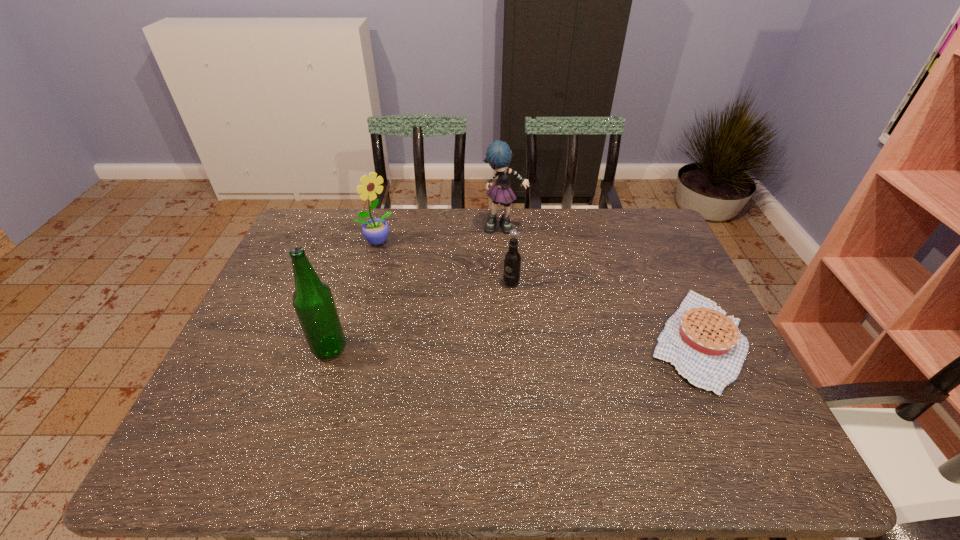
Image resolution: width=960 pixels, height=540 pixels. Find the location of `vacant space on the desktop that is between the beer bottle and the pie and is positioned on the front-facing side of the rag doll`. vacant space on the desktop that is between the beer bottle and the pie and is positioned on the front-facing side of the rag doll is located at coordinates (539, 343).

You are a GUI agent. You are given a task and a screenshot of the screen. Output one action in this format:
    pyautogui.click(x=<x>, y=<y>)
    Task: Click on the vacant space on the desktop that is between the beer bottle and the pie and is positioned on the label of the fourth tallest object
    Image resolution: width=960 pixels, height=540 pixels.
    Given the screenshot: What is the action you would take?
    pyautogui.click(x=474, y=345)

At what (x,y) coordinates should I click in order to perform the action: click on free spot on the desktop that is between the beer bottle and the pie and is positioned on the front-facing side of the third shortest object. Please return your answer as a coordinate pair (x, y). Looking at the image, I should click on (503, 344).